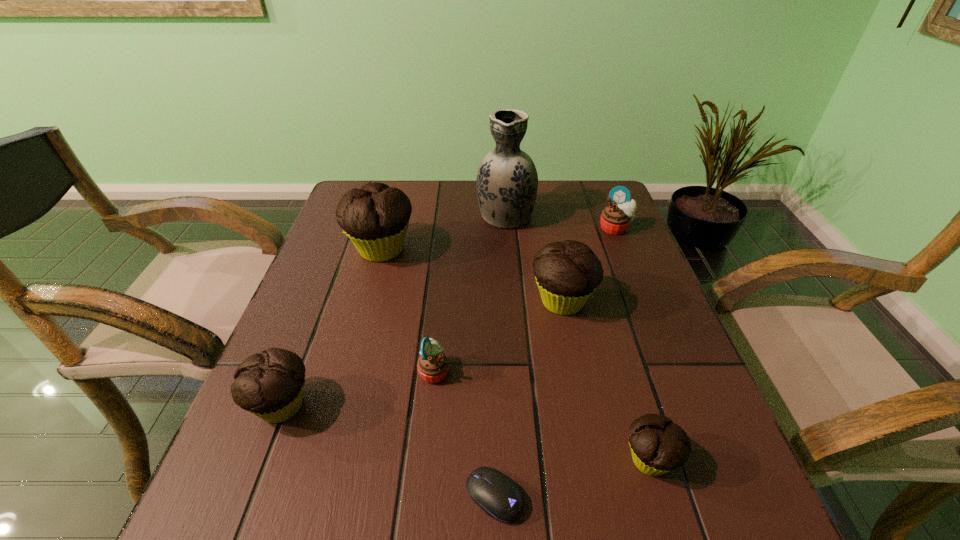
The height and width of the screenshot is (540, 960). Identify the location of muffin that is the second closest to the bigger pink muffin. (375, 218).

Choose which muffin is the second nearest neighbor to the biggest chocolate muffin. Please provide its 2D coordinates. Your answer should be formatted as a tuple, i.e. [(x, y)], where the tuple contains the x and y coordinates of a point satisfying the conditions above.

[(567, 273)]

Point out which chocolate muffin is positioned as the third nearest to the second tallest muffin. Please provide its 2D coordinates. Your answer should be formatted as a tuple, i.e. [(x, y)], where the tuple contains the x and y coordinates of a point satisfying the conditions above.

[(270, 385)]

Identify the location of chocolate muffin identified as the third closest to the blue vase. (270, 385).

Where is `free space that satisfies the following two spatial constraints: 1. on the front-facing side of the smallest chocolate muffin; 2. on the right side of the left pink muffin`? The image size is (960, 540). free space that satisfies the following two spatial constraints: 1. on the front-facing side of the smallest chocolate muffin; 2. on the right side of the left pink muffin is located at coordinates (425, 460).

The height and width of the screenshot is (540, 960). What are the coordinates of `vacant space that satisfies the following two spatial constraints: 1. on the front side of the smallest chocolate muffin; 2. on the left side of the farthest chocolate muffin` in the screenshot? It's located at (323, 460).